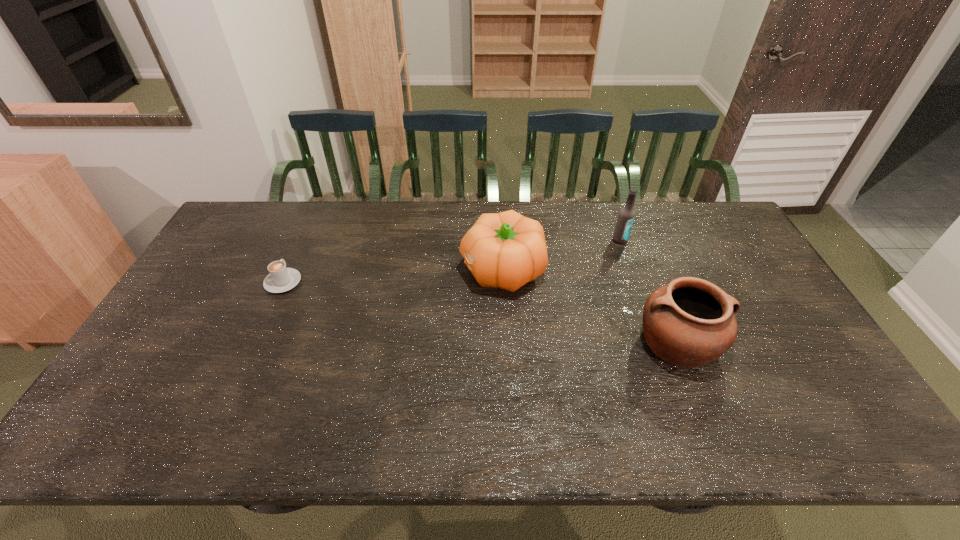
The width and height of the screenshot is (960, 540). I want to click on beer bottle, so click(x=626, y=216).

Where is `the third object from right to left`? This screenshot has width=960, height=540. the third object from right to left is located at coordinates (506, 250).

Identify the location of pottery. This screenshot has width=960, height=540. (690, 322).

At what (x,y) coordinates should I click in order to perform the action: click on the nearest object. Please return your answer as a coordinate pair (x, y). The height and width of the screenshot is (540, 960). Looking at the image, I should click on (690, 322).

The image size is (960, 540). Identify the location of the leftmost object. pos(281,279).

Where is `the shortest object`? the shortest object is located at coordinates (281, 279).

The height and width of the screenshot is (540, 960). Identify the location of free space located 0.350m on the label of the beer bottle. (651, 326).

Where is `free space located on the carved face of the pumpkin`? free space located on the carved face of the pumpkin is located at coordinates (368, 270).

At what (x,y) coordinates should I click in order to perform the action: click on vacant space located on the carved face of the pumpkin. Please return your answer as a coordinate pair (x, y). Looking at the image, I should click on (425, 270).

Locate an element on the screen. free space located 0.350m on the carved face of the pumpkin is located at coordinates (348, 270).